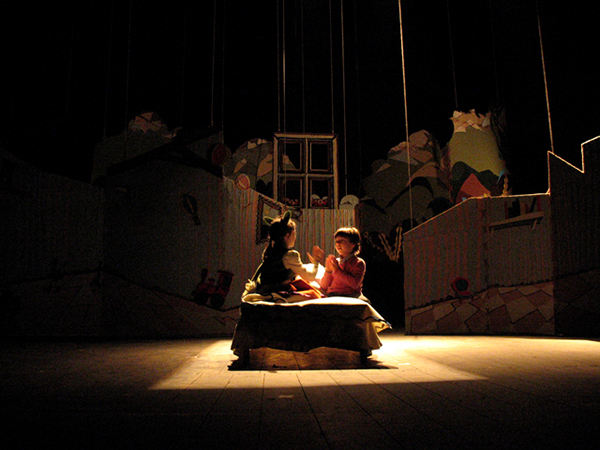
I want to click on floor, so click(x=446, y=354).